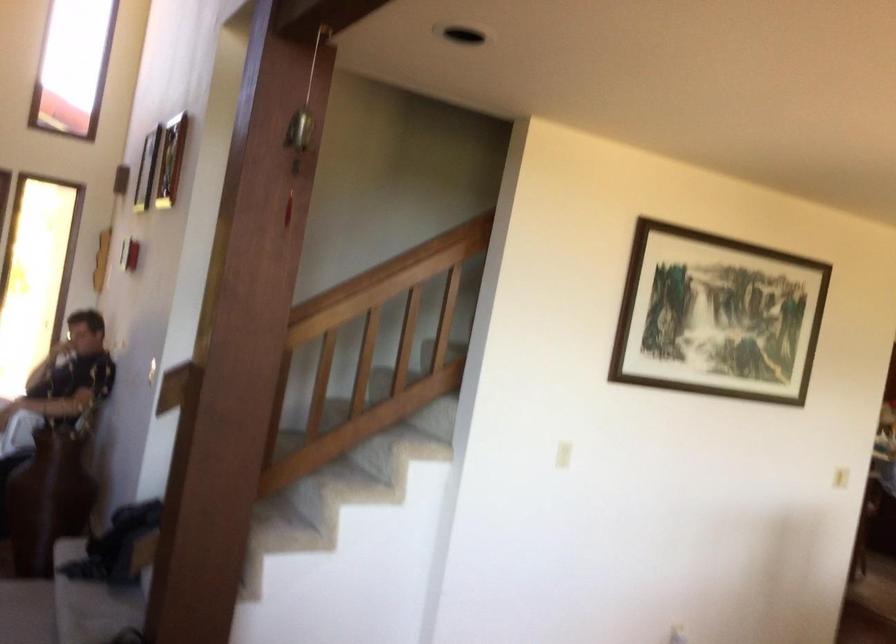
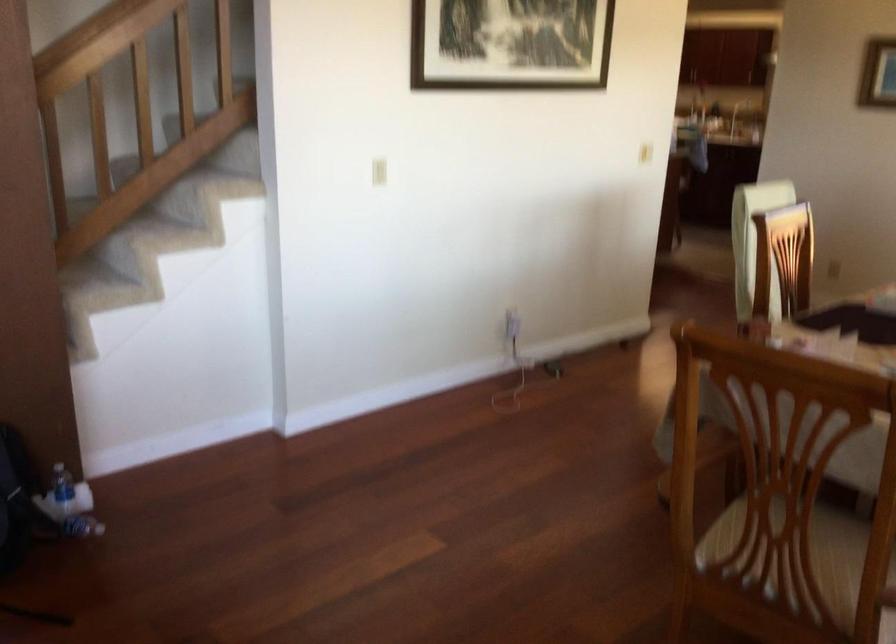
Question: I am providing you with two images of the same scene from different viewpoints. Which of the following objects are not visible in image2?

Choices:
 (A) chair sitting surface
 (B) plastic water bottle
 (C) wooden handrail
 (D) none of these

Answer: (D)